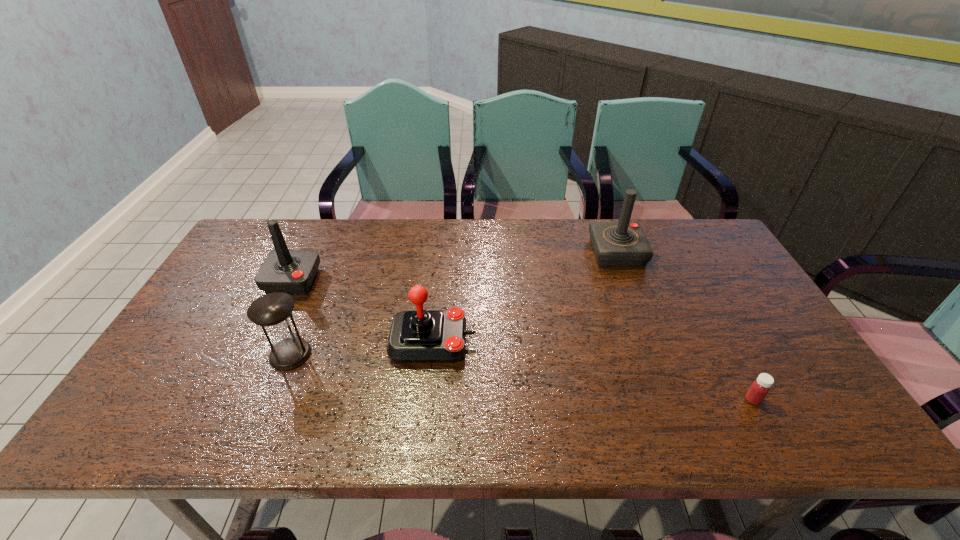
The width and height of the screenshot is (960, 540). Identify the location of vacant space situated on the front of the leftmost joystick. (241, 389).

Locate an element on the screen. vacant space situated on the base of the nearest joystick is located at coordinates (549, 341).

The image size is (960, 540). I want to click on vacant region located on the right of the hourglass, so click(426, 354).

The height and width of the screenshot is (540, 960). In order to click on vacant space located 0.250m on the back of the shortest object in this screenshot , I will do `click(708, 316)`.

The image size is (960, 540). In order to click on object present at the far edge in this screenshot , I will do `click(623, 243)`.

The width and height of the screenshot is (960, 540). Identify the location of object located at the near edge. (759, 389).

This screenshot has width=960, height=540. What are the coordinates of `object that is at the left edge` in the screenshot? It's located at [292, 271].

Locate an element on the screen. object at the right edge is located at coordinates (759, 389).

Identify the location of object that is at the near right corner. The height and width of the screenshot is (540, 960). (759, 389).

In order to click on vacant area at the far edge of the desktop in this screenshot , I will do 300,233.